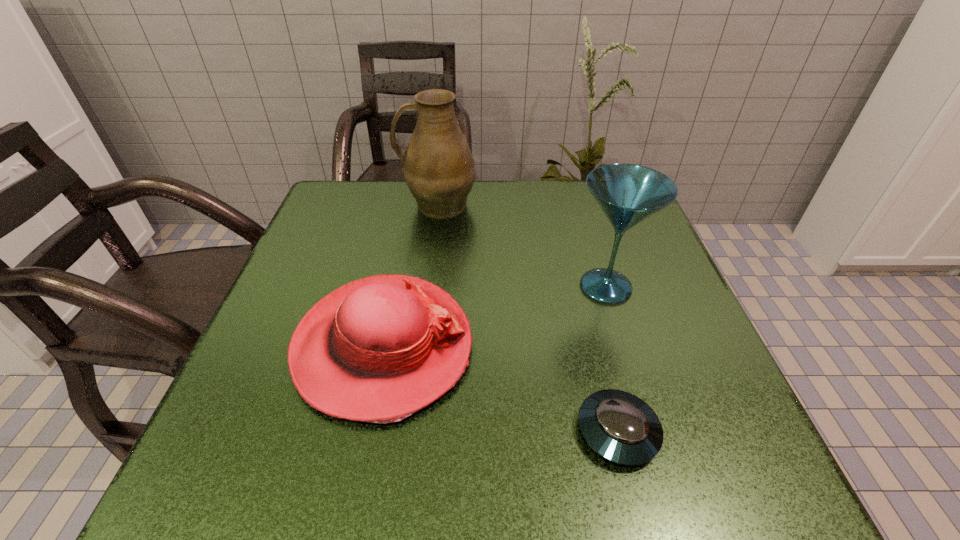
Locate an element on the screen. The width and height of the screenshot is (960, 540). vacant area that lies between the saucer and the martini is located at coordinates (612, 359).

Find the location of a particular element. unoccupied area between the saucer and the martini is located at coordinates (612, 359).

Where is `vacant area between the second tallest object and the second shortest object`? This screenshot has height=540, width=960. vacant area between the second tallest object and the second shortest object is located at coordinates (494, 316).

Identify the location of the second closest object relative to the saucer. The height and width of the screenshot is (540, 960). (628, 194).

You are a GUI agent. You are given a task and a screenshot of the screen. Output one action in this format:
    pyautogui.click(x=<x>, y=<y>)
    Task: Click on the object that stands as the closest to the hat
    
    Given the screenshot: What is the action you would take?
    pyautogui.click(x=622, y=428)

Where is `free spot that satisfies the following two spatial constraints: 1. on the front side of the third shortest object; 2. at the front of the hat with a bow`? The height and width of the screenshot is (540, 960). free spot that satisfies the following two spatial constraints: 1. on the front side of the third shortest object; 2. at the front of the hat with a bow is located at coordinates (624, 346).

Find the location of `vacant space that satisfies the following two spatial constraints: 1. at the front of the second shortest object with a bow; 2. on the back side of the saucer`. vacant space that satisfies the following two spatial constraints: 1. at the front of the second shortest object with a bow; 2. on the back side of the saucer is located at coordinates (366, 431).

Identify the location of free location that satisfies the following two spatial constraints: 1. at the front of the hat with a bow; 2. on the right side of the saucer. Image resolution: width=960 pixels, height=540 pixels. (366, 431).